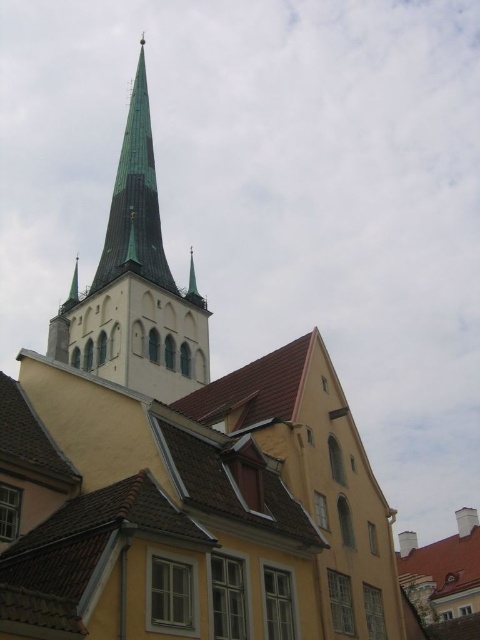
You are standing in front of the historic building and notice a specific point marked at coordinates (x=135, y=285). Based on the building description, can you identify which part of the building this point corresponds to?

The point at coordinates (x=135, y=285) is located on the green glass spire at upper center of the building.

You are standing in front of the historic building and want to take a photo. You notice two points marked on the building. The first point is at coordinates point [166,339] and the second is at point [127,266]. Which point is closer to your camera when taking the photo?

Point [166,339] is further to the camera than point [127,266], so the second point is closer to the camera.